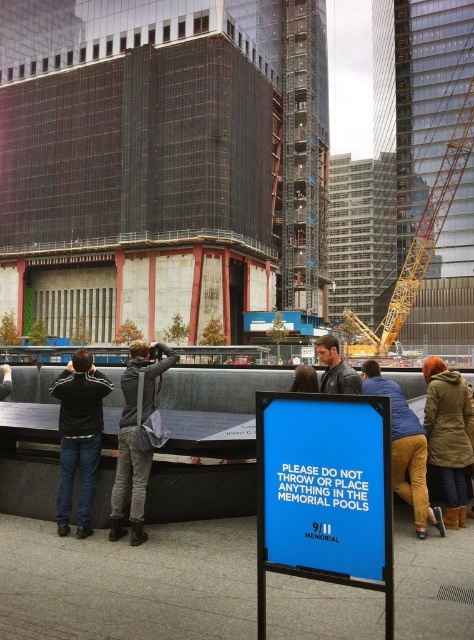
Does blue plastic sign at center appear on the left side of black matte jacket at left?

No, blue plastic sign at center is not to the left of black matte jacket at left.

Which is in front, point (343, 493) or point (85, 378)?

Point (343, 493) is more forward.

Locate an element on the screen. This screenshot has width=474, height=640. blue plastic sign at center is located at coordinates pyautogui.click(x=326, y=486).

Can you confirm if concrete wall at center is smaller than blue plastic sign at center?

Yes.

Does concrete wall at center come in front of blue plastic sign at center?

No, concrete wall at center is further to the viewer.

Locate an element on the screen. The height and width of the screenshot is (640, 474). concrete wall at center is located at coordinates (151, 545).

Locate an element on the screen. concrete wall at center is located at coordinates (151, 545).

Does point (147, 468) lie in front of point (424, 490)?

Yes.

Based on the photo, does gray jeans at center appear over yellow hard hat at lower right?

Correct, gray jeans at center is located above yellow hard hat at lower right.

Identify the location of gray jeans at center. (136, 436).

Locate an element on the screen. The height and width of the screenshot is (640, 474). gray jeans at center is located at coordinates (136, 436).